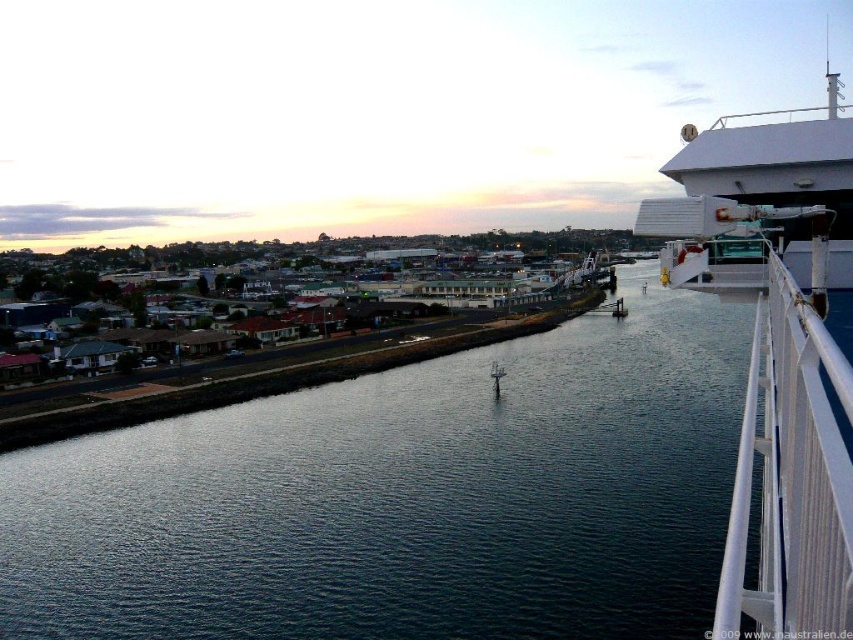
Who is positioned more to the right, white textured rail at right or white matte cruise ship at upper right?

From the viewer's perspective, white matte cruise ship at upper right appears more on the right side.

Does white textured rail at right appear under white matte cruise ship at upper right?

Correct, white textured rail at right is located below white matte cruise ship at upper right.

Which is in front, point (836, 369) or point (672, 253)?

Point (836, 369) is more forward.

Identify the location of white textured rail at right. The width and height of the screenshot is (853, 640). (791, 477).

Does dark blue water at center come in front of white textured rail at right?

No.

Does point (265, 419) lie behind point (848, 368)?

That is True.

Does point (392, 493) lie behind point (773, 253)?

Yes, it is behind point (773, 253).

Find the location of a particular element. The height and width of the screenshot is (640, 853). dark blue water at center is located at coordinates (405, 497).

Can you confirm if dark blue water at center is wider than white matte cruise ship at upper right?

Incorrect, dark blue water at center's width does not surpass white matte cruise ship at upper right's.

Is point (299, 467) positioned after point (718, 189)?

Yes, point (299, 467) is behind point (718, 189).

Where is `dark blue water at center`? dark blue water at center is located at coordinates (405, 497).